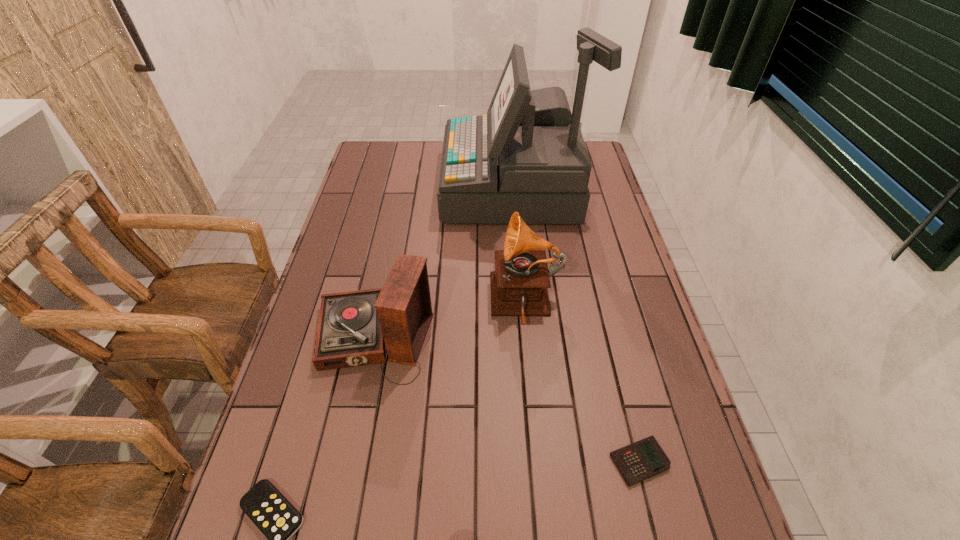
Locate an element on the screen. vacant position located on the horn of the fourth shortest object is located at coordinates (455, 302).

Where is `free space located on the horn of the fourth shortest object`? This screenshot has width=960, height=540. free space located on the horn of the fourth shortest object is located at coordinates (386, 302).

The height and width of the screenshot is (540, 960). Find the location of `free space located 0.280m on the horn of the fourth shortest object`. free space located 0.280m on the horn of the fourth shortest object is located at coordinates click(x=390, y=302).

The image size is (960, 540). Identify the location of vacant position located on the back of the shorter phonograph record. (395, 236).

I want to click on free space located on the right of the calculator, so click(x=702, y=462).

Identify the location of object situated at the far edge. The image size is (960, 540). (527, 155).

Locate an element on the screen. This screenshot has width=960, height=540. object present at the left edge is located at coordinates (354, 327).

Where is `cash register that is positioned at the right edge`? This screenshot has width=960, height=540. cash register that is positioned at the right edge is located at coordinates (527, 155).

The height and width of the screenshot is (540, 960). I want to click on calculator at the right edge, so click(x=641, y=460).

Find the location of a particular element. This screenshot has height=540, width=960. object that is at the far right corner is located at coordinates (527, 155).